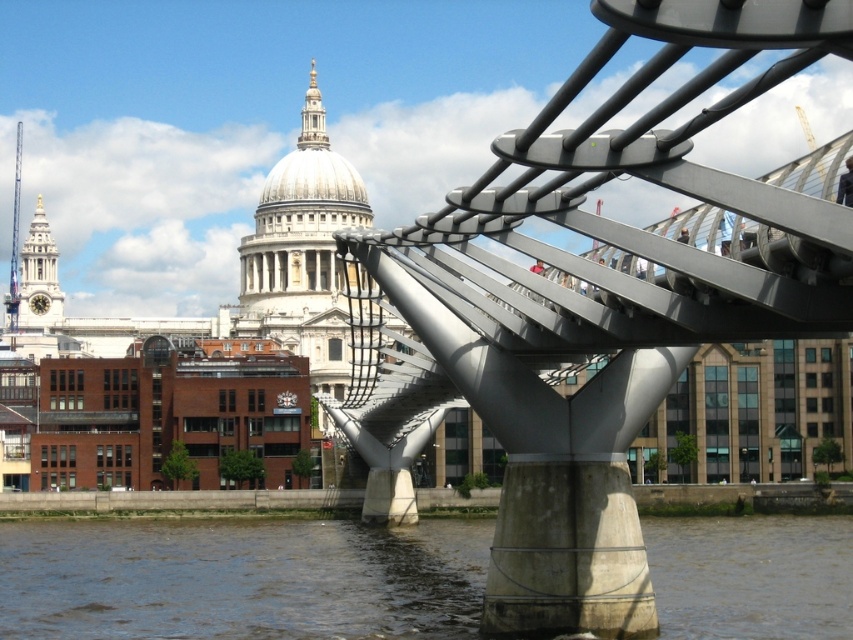
Question: Which point is closer to the camera?

Choices:
 (A) (686, 573)
 (B) (756, 29)

Answer: (B)

Question: Which point is farther to the camera?

Choices:
 (A) (602, 112)
 (B) (306, 540)

Answer: (B)

Question: Does metallic silver suspension bridge at center lie behind brown water at lower center?

Choices:
 (A) no
 (B) yes

Answer: (A)

Question: Can you confirm if metallic silver suspension bridge at center is positioned to the left of brown water at lower center?

Choices:
 (A) no
 (B) yes

Answer: (A)

Question: Is metallic silver suspension bridge at center positioned in front of brown water at lower center?

Choices:
 (A) yes
 (B) no

Answer: (A)